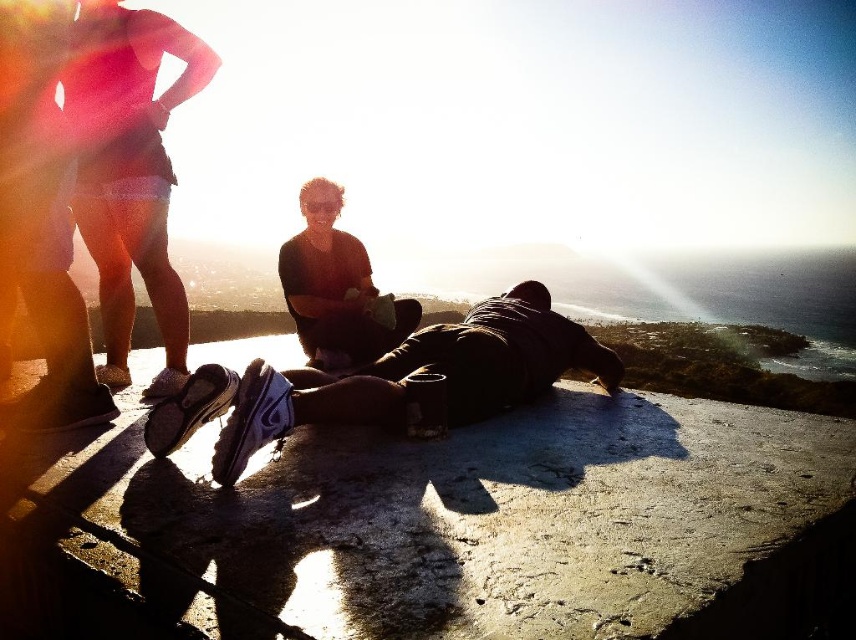
Based on the photo, you are a photographer wanting to capture both the dark brown leather jacket at center and the matte black shirt at center in a single frame. Since the jacket is larger, where should you position your camera to ensure both items are clearly visible without cropping either?

Position the camera slightly closer to the matte black shirt at center so that the larger dark brown leather jacket at center remains in frame while the smaller matte black shirt at center fills the space effectively.

You are a photographer trying to capture a photo of the dark brown leather jacket at center and the matte black shirt at center. Since you want both subjects to be in focus, which one should you focus on first to ensure the other is also sharp?

You should focus on the dark brown leather jacket at center first because it is in front of the matte black shirt at center. By focusing on the closer subject, the depth of field will extend backward, potentially keeping both in focus.

You are a hiker who just arrived at the viewing platform and want to place your backpack near the dark brown leather jacket at center so it won t get in the way. Where should you place your backpack?

You should place your backpack near the dark brown leather jacket at center at point (388,380).